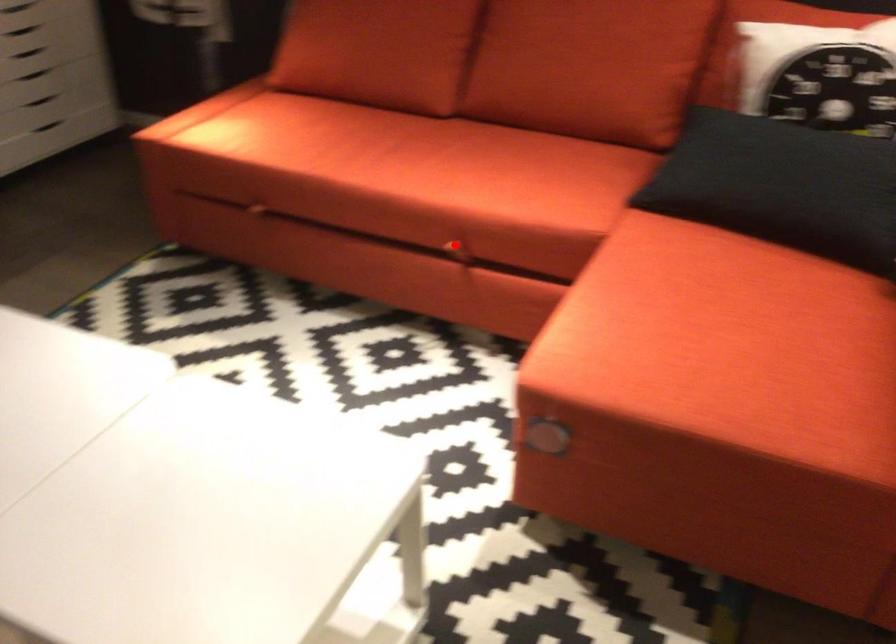
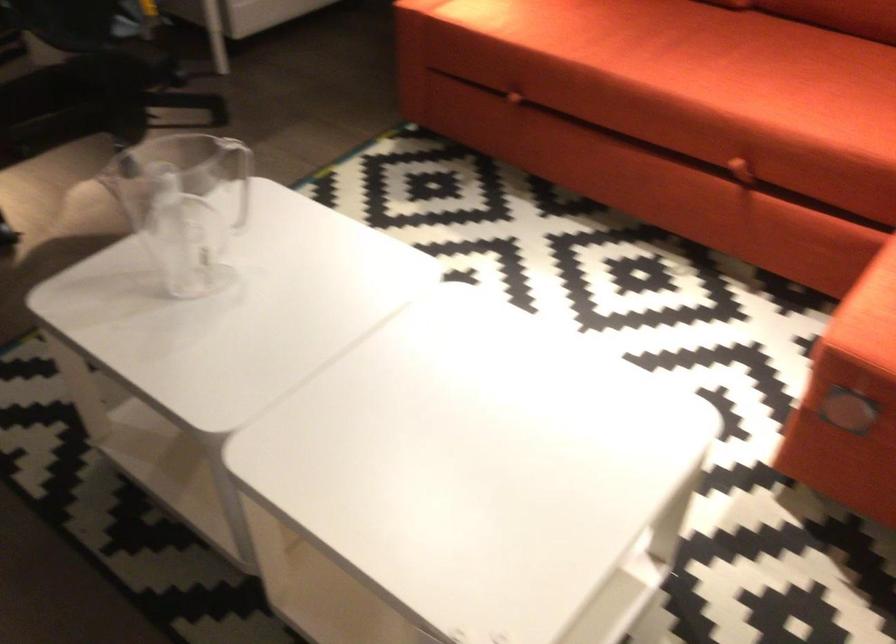
Where in the second image is the point corresponding to the highlighted location from the first image?

(737, 160)